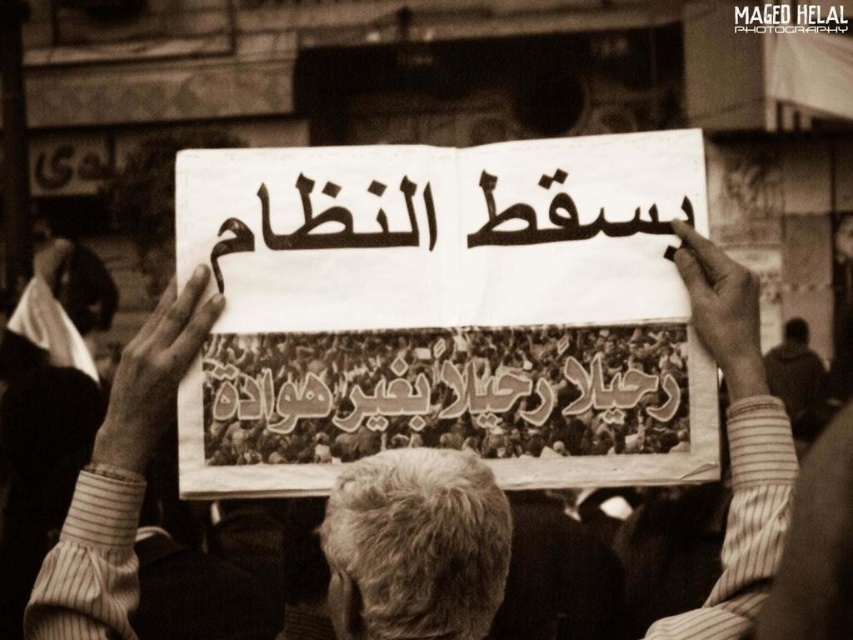
Question: Which point is farther to the camera?

Choices:
 (A) (695, 330)
 (B) (209, 163)

Answer: (B)

Question: Does white paper at center appear on the right side of striped shirt at center?

Choices:
 (A) no
 (B) yes

Answer: (B)

Question: Is white paper at center wider than striped shirt at center?

Choices:
 (A) no
 (B) yes

Answer: (B)

Question: Which point is closer to the camera?

Choices:
 (A) striped shirt at center
 (B) white paper at center

Answer: (A)

Question: Which of the following is the closest to the observer?

Choices:
 (A) (747, 385)
 (B) (299, 422)

Answer: (A)

Question: Is white paper at center bigger than striped shirt at center?

Choices:
 (A) no
 (B) yes

Answer: (B)